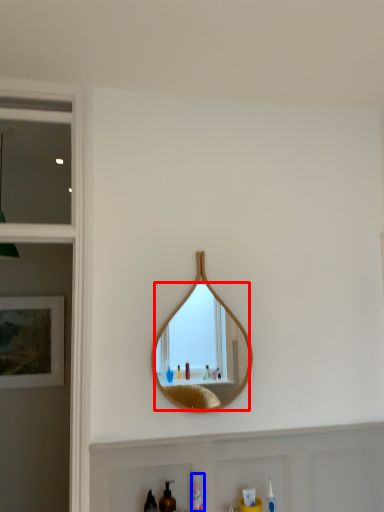
Question: Which object appears farthest to the camera in this image, mirror (highlighted by a red box) or mouthwash (highlighted by a blue box)?

Choices:
 (A) mirror
 (B) mouthwash

Answer: (A)